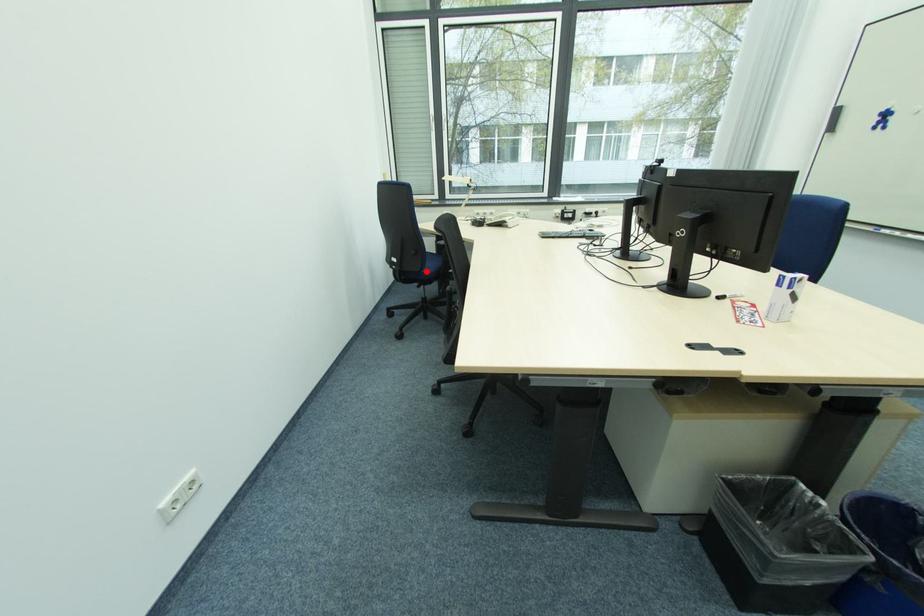
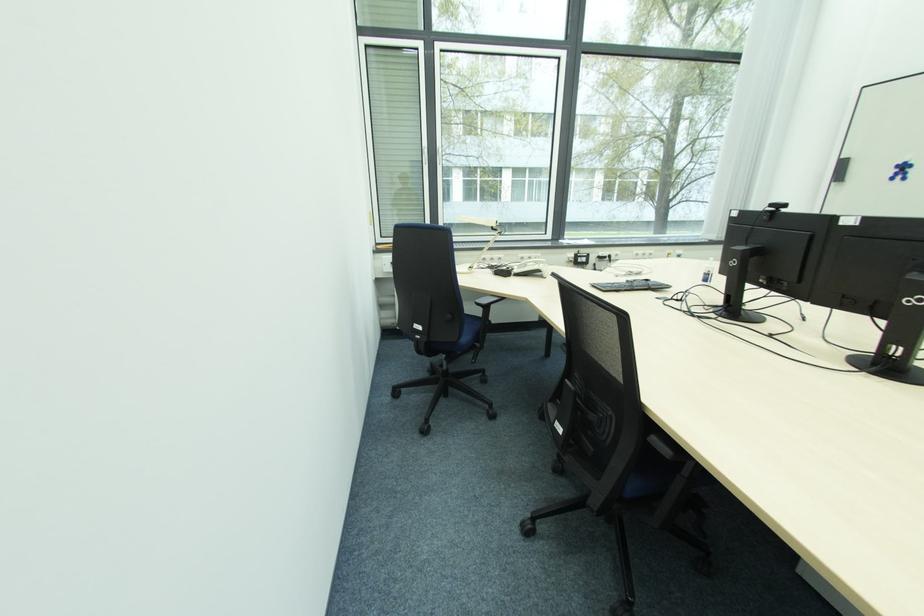
In the second image, find the point that corresponds to the highlighted location in the first image.

(463, 341)